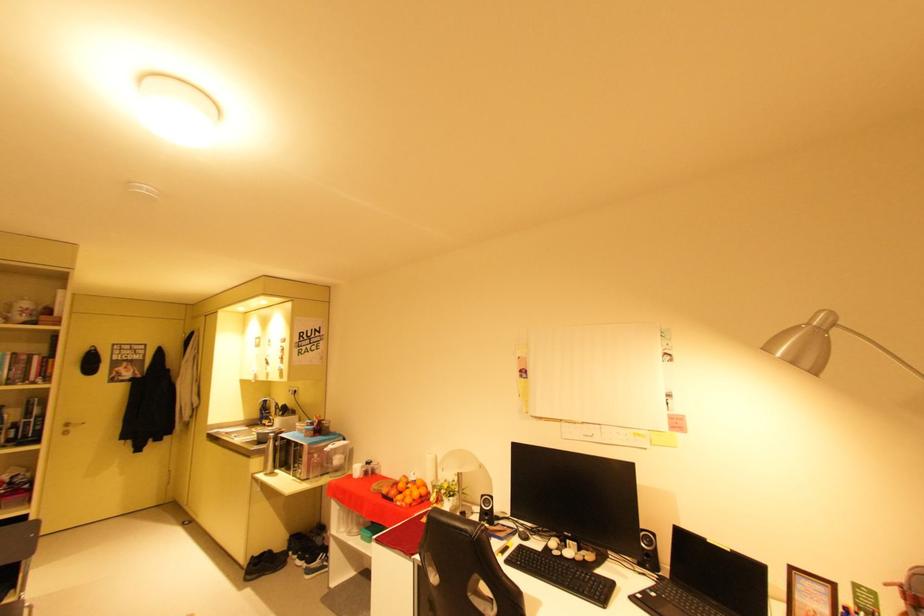
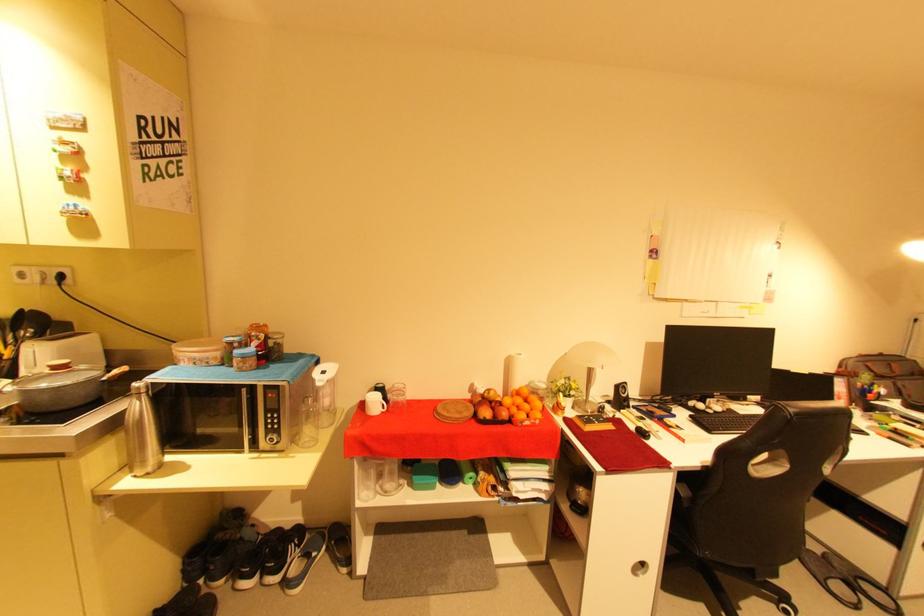
Where in the second image is the point corresponding to pixel 322 429 from the first image?

(265, 352)